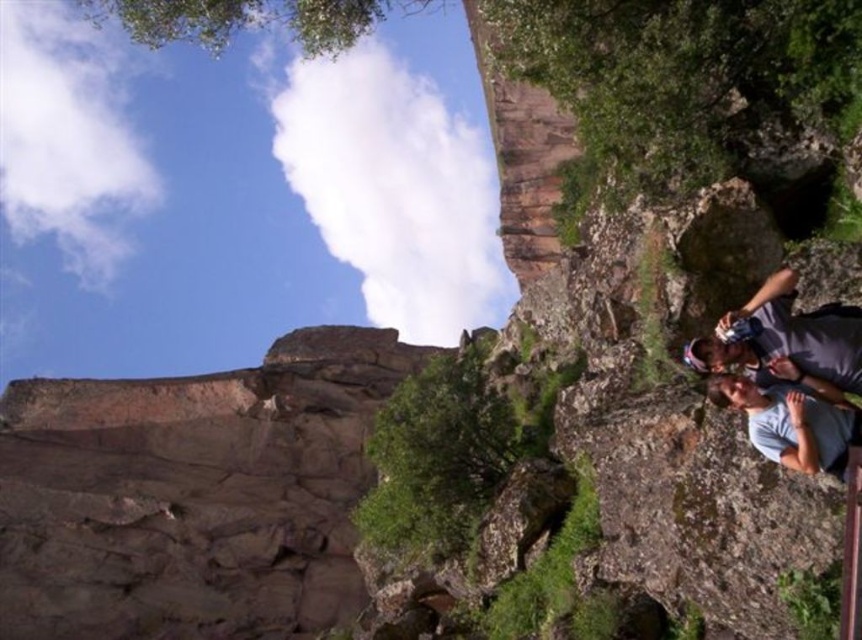
Question: Which point is farther to the camera?

Choices:
 (A) gray cotton shirt at lower right
 (B) gray fabric shirt at lower right

Answer: (A)

Question: Does gray fabric shirt at lower right have a lesser width compared to gray cotton shirt at lower right?

Choices:
 (A) no
 (B) yes

Answer: (A)

Question: Can you confirm if gray fabric shirt at lower right is positioned to the right of gray cotton shirt at lower right?

Choices:
 (A) yes
 (B) no

Answer: (A)

Question: Is gray fabric shirt at lower right closer to the viewer compared to gray cotton shirt at lower right?

Choices:
 (A) no
 (B) yes

Answer: (B)